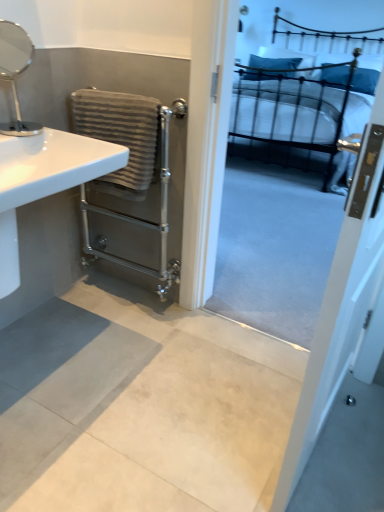
Question: From a real-world perspective, is white glossy sink at left positioned over metallic black bed at upper right based on gravity?

Choices:
 (A) yes
 (B) no

Answer: (A)

Question: Is white glossy sink at left in contact with metallic black bed at upper right?

Choices:
 (A) no
 (B) yes

Answer: (A)

Question: Is white glossy sink at left bigger than metallic black bed at upper right?

Choices:
 (A) yes
 (B) no

Answer: (B)

Question: Does white glossy sink at left have a lesser height compared to metallic black bed at upper right?

Choices:
 (A) yes
 (B) no

Answer: (A)

Question: Could metallic black bed at upper right be considered to be inside white glossy sink at left?

Choices:
 (A) no
 (B) yes

Answer: (A)

Question: Considering the positions of metallic black bed at upper right and white glossy screen door at upper right in the image, is metallic black bed at upper right bigger or smaller than white glossy screen door at upper right?

Choices:
 (A) small
 (B) big

Answer: (B)

Question: Considering the relative positions of metallic black bed at upper right and white glossy screen door at upper right in the image provided, is metallic black bed at upper right to the left or to the right of white glossy screen door at upper right?

Choices:
 (A) right
 (B) left

Answer: (A)

Question: From the image's perspective, is metallic black bed at upper right above or below white glossy screen door at upper right?

Choices:
 (A) above
 (B) below

Answer: (A)

Question: Is metallic black bed at upper right wider or thinner than white glossy screen door at upper right?

Choices:
 (A) wide
 (B) thin

Answer: (A)

Question: Would you say silver metallic mirror at upper left is to the left or to the right of white glossy screen door at upper right in the picture?

Choices:
 (A) right
 (B) left

Answer: (B)

Question: From the image's perspective, is silver metallic mirror at upper left positioned above or below white glossy screen door at upper right?

Choices:
 (A) above
 (B) below

Answer: (A)

Question: Is silver metallic mirror at upper left in front of or behind white glossy screen door at upper right in the image?

Choices:
 (A) behind
 (B) front

Answer: (A)

Question: Would you say silver metallic mirror at upper left is inside or outside white glossy screen door at upper right?

Choices:
 (A) outside
 (B) inside

Answer: (A)

Question: From a real-world perspective, is gray textured towel at left above or below white glossy sink at left?

Choices:
 (A) above
 (B) below

Answer: (B)

Question: Based on their sizes in the image, would you say gray textured towel at left is bigger or smaller than white glossy sink at left?

Choices:
 (A) big
 (B) small

Answer: (B)